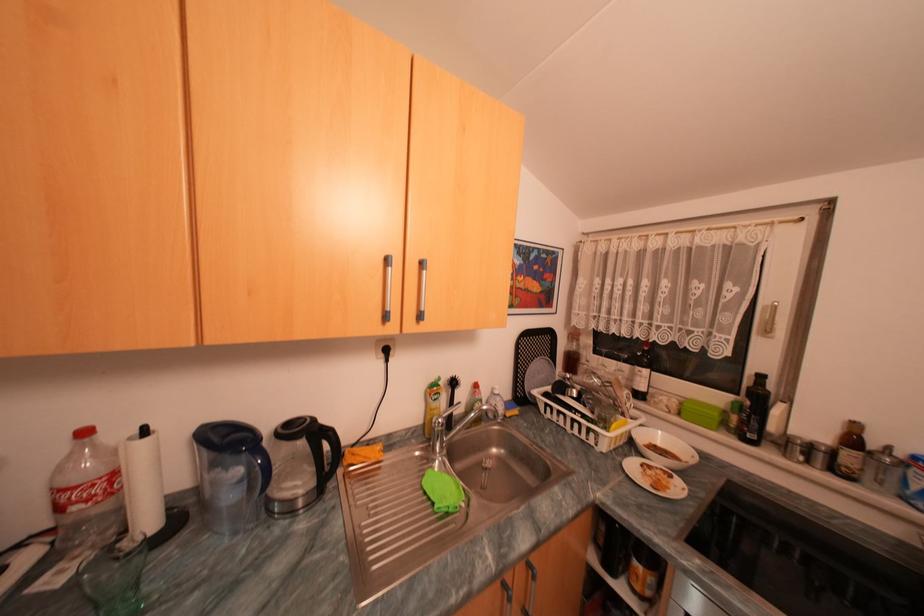
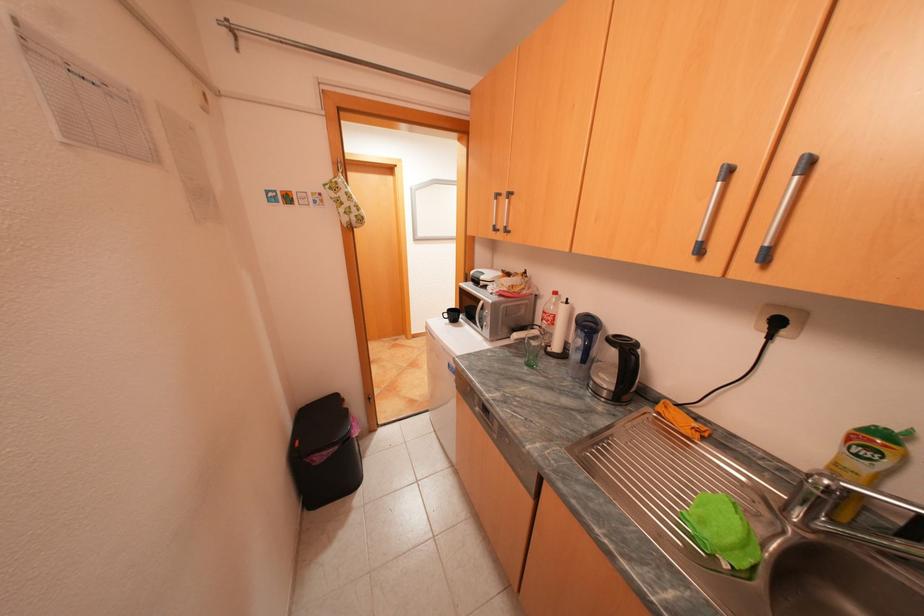
Where in the second image is the point corresponding to point 473,504 from the first image?

(736, 565)